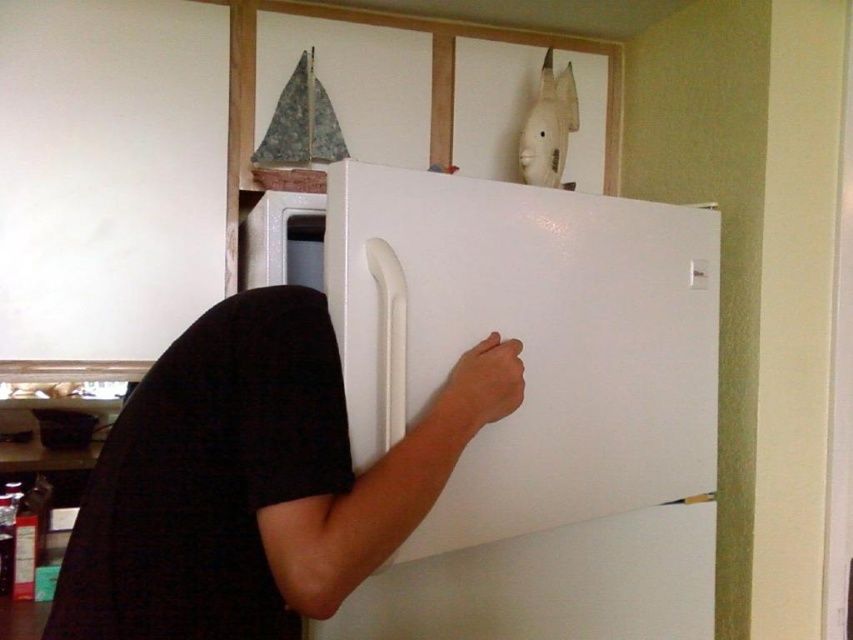
You are standing in a kitchen and want to reach the white glossy refrigerator at center. There is a black matte shirt at center in your way. Which object is closer to you, making it an obstacle?

The white glossy refrigerator at center is closer to you than the black matte shirt at center, so the refrigerator itself is the obstacle in your path.

You are standing in the kitchen and want to reach the point marked at coordinates (592, 596). Can you estimate how far this point is from your current position?

The point marked at coordinates (592, 596) is 1.15 meters away from the viewer, so you are approximately 1.15 meters away from that point.

You are standing in the kitchen and want to place a small bowl on the counter next to the white glossy refrigerator at center. However, you notice the black matte shirt at center is hanging there. Can you place the bowl there without moving the shirt?

The white glossy refrigerator at center is positioned on the right side of the black matte shirt at center, meaning the shirt is on the left side of the refrigerator. Since the shirt is hanging next to the refrigerator, there might still be space on the counter to place the bowl either to the left of the shirt or to the right of the refrigerator, depending on the available space. However, without knowing the exact dimensions of the counter and the objects, it is uncertain if the bowl can be placed there. To